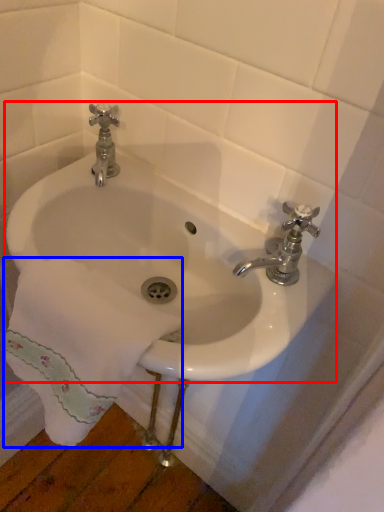
Question: Which point is further to the camera, sink (highlighted by a red box) or bath towel (highlighted by a blue box)?

Choices:
 (A) sink
 (B) bath towel

Answer: (A)